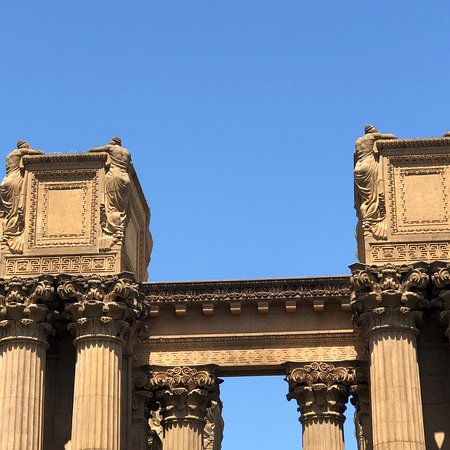
Find the location of `capital of column`. capital of column is located at coordinates (16, 306), (90, 297), (388, 292), (319, 381), (177, 380).